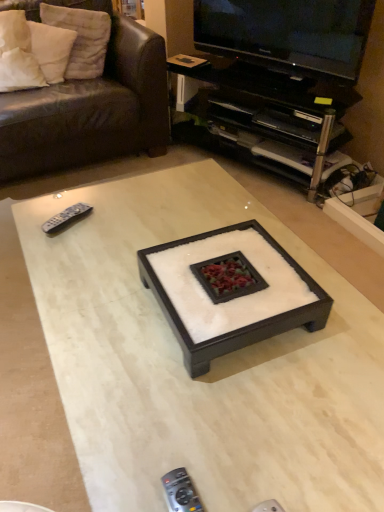
Image resolution: width=384 pixels, height=512 pixels. In order to click on free space in front of white felt square tray at center, the 2th coffee table positioned from the bottom in this screenshot , I will do `click(237, 418)`.